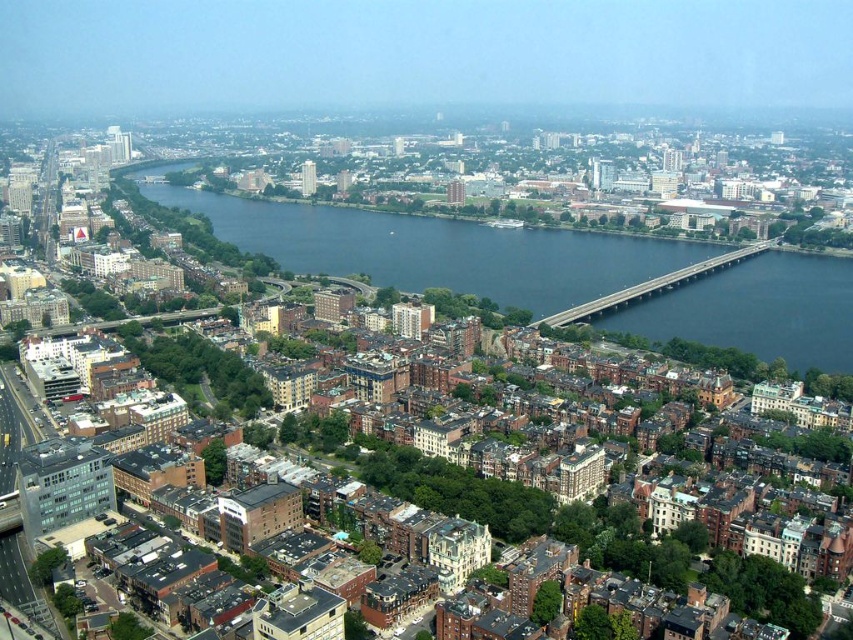
You are a drone operator flying a drone above the city. You need to navigate between two points marked as point (358,248) and point (541,323). Which point is closer to your current position at the camera?

Point (358,248) is closer to the camera than point (541,323) because it is further to the camera.

You are a drone operator flying over the city. You need to deliver a package to a building near the dark blue water at center. The concrete bridge at center is directly below your flight path. Will the bridge block your path to the water?

The dark blue water at center is located above the concrete bridge at center, so the bridge will not block your path to the water since the water is positioned above it.

You are a delivery drone operator. Your drone has a wingspan of 1.2 meters. You need to fly it through the gap between the dark blue water at center and the concrete bridge at center to reach the delivery point on the other side. Can your drone safely pass through this gap?

The dark blue water at center might be wider than the concrete bridge at center. Since the bridge is part of the structure over the water, the gap under the bridge would likely be at least as wide as the water itself. Given the drone has a wingspan of 1.2 meters, it should safely pass through the gap as long as the bridge clearance accommodates its size. However, without exact measurements, there is some uncertainty based on the description provided.